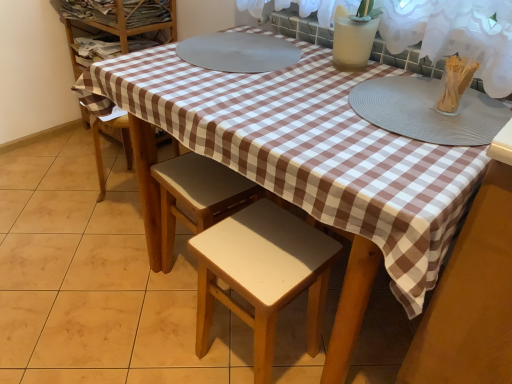
This screenshot has width=512, height=384. Identify the location of vacant space behind clear plastic container at upper right. (416, 87).